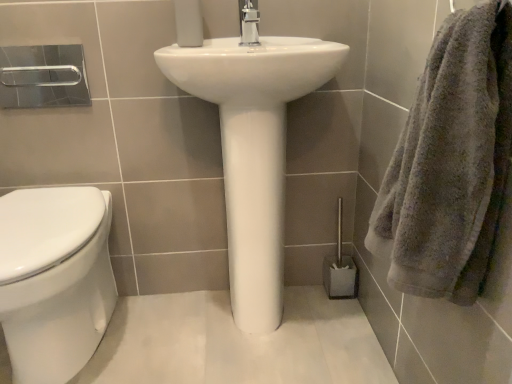
Question: From the image's perspective, is white glossy toilet at left located above or below white glossy sink at center?

Choices:
 (A) above
 (B) below

Answer: (B)

Question: Is white glossy toilet at left bigger or smaller than white glossy sink at center?

Choices:
 (A) small
 (B) big

Answer: (A)

Question: Which object is positioned closest to the gray fluffy towel at right?

Choices:
 (A) white matte toilet paper at upper center
 (B) white glossy toilet at left
 (C) white glossy sink at center
 (D) gray plastic toilet brush at lower right
 (E) polished chrome faucet at center

Answer: (C)

Question: Which object is positioned closest to the gray fluffy towel at right?

Choices:
 (A) white glossy sink at center
 (B) polished chrome faucet at center
 (C) white glossy toilet at left
 (D) gray plastic toilet brush at lower right
 (E) white matte toilet paper at upper center

Answer: (A)